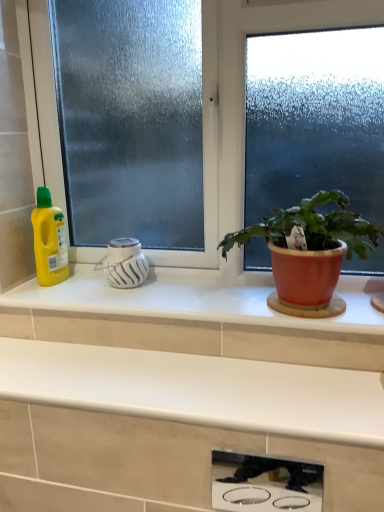
Question: Is matte terracotta pot at right thinner than stainless steel cooktop at lower center, which ranks as the first appliance in right-to-left order?

Choices:
 (A) no
 (B) yes

Answer: (A)

Question: Considering the relative sizes of matte terracotta pot at right and stainless steel cooktop at lower center, placed as the second appliance when sorted from top to bottom, in the image provided, is matte terracotta pot at right bigger than stainless steel cooktop at lower center, placed as the second appliance when sorted from top to bottom,?

Choices:
 (A) yes
 (B) no

Answer: (A)

Question: Does matte terracotta pot at right turn towards stainless steel cooktop at lower center, placed as the second appliance when sorted from top to bottom?

Choices:
 (A) yes
 (B) no

Answer: (B)

Question: Does matte terracotta pot at right lie behind stainless steel cooktop at lower center, the second appliance in the back-to-front sequence?

Choices:
 (A) no
 (B) yes

Answer: (B)

Question: Is matte terracotta pot at right far away from stainless steel cooktop at lower center, which is counted as the second appliance, starting from the left?

Choices:
 (A) no
 (B) yes

Answer: (B)

Question: Visually, is yellow plastic bottle at left positioned to the left or to the right of white matte countertop at center, which appears as the 2th countertop when viewed from the top?

Choices:
 (A) right
 (B) left

Answer: (B)

Question: Is yellow plastic bottle at left situated inside white matte countertop at center, which appears as the 2th countertop when viewed from the top, or outside?

Choices:
 (A) outside
 (B) inside

Answer: (A)

Question: Is yellow plastic bottle at left bigger or smaller than white matte countertop at center, placed as the first countertop when sorted from bottom to top?

Choices:
 (A) small
 (B) big

Answer: (A)

Question: From a real-world perspective, is yellow plastic bottle at left physically located above or below white matte countertop at center, which appears as the 2th countertop when viewed from the top?

Choices:
 (A) below
 (B) above

Answer: (B)

Question: Choose the correct answer: Is white matte countertop at center, placed as the first countertop when sorted from bottom to top, inside stainless steel cooktop at lower center, arranged as the 1th appliance when viewed from the front, or outside it?

Choices:
 (A) inside
 (B) outside

Answer: (B)

Question: Looking at the image, does white matte countertop at center, placed as the first countertop when sorted from bottom to top, seem bigger or smaller compared to stainless steel cooktop at lower center, placed as the second appliance when sorted from top to bottom?

Choices:
 (A) big
 (B) small

Answer: (A)

Question: In the image, is white matte countertop at center, placed as the first countertop when sorted from bottom to top, on the left side or the right side of stainless steel cooktop at lower center, the second appliance in the back-to-front sequence?

Choices:
 (A) right
 (B) left

Answer: (B)

Question: From the image's perspective, is white matte countertop at center, placed as the first countertop when sorted from bottom to top, above or below stainless steel cooktop at lower center, arranged as the 1th appliance when viewed from the front?

Choices:
 (A) above
 (B) below

Answer: (A)

Question: From the image's perspective, is white glossy countertop at center, acting as the second countertop starting from the bottom, positioned above or below white matte diffuser at center, marked as the first appliance in a left-to-right arrangement?

Choices:
 (A) below
 (B) above

Answer: (A)

Question: Considering their positions, is white glossy countertop at center, acting as the second countertop starting from the bottom, located in front of or behind white matte diffuser at center, marked as the first appliance in a left-to-right arrangement?

Choices:
 (A) behind
 (B) front

Answer: (B)